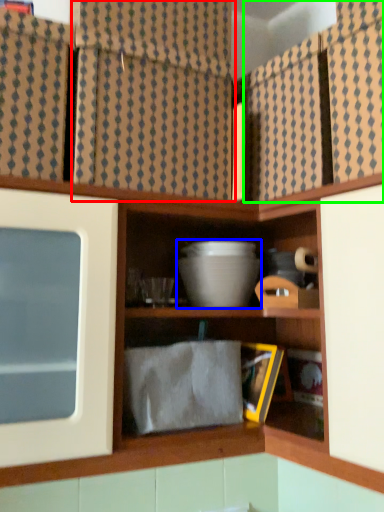
Question: Which is nearer to the curtain (highlighted by a red box)? mixing bowl (highlighted by a blue box) or cabinet (highlighted by a green box).

Choices:
 (A) mixing bowl
 (B) cabinet

Answer: (B)